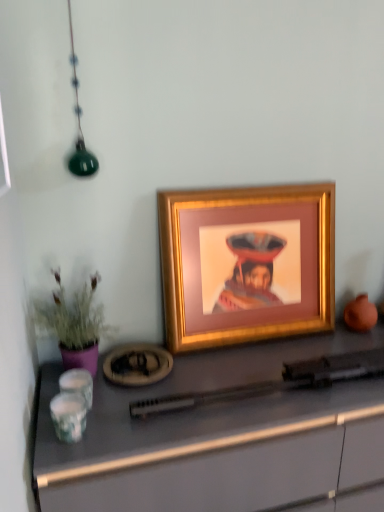
Question: In terms of height, does gold metallic picture frame at center look taller or shorter compared to purple matte plant at left?

Choices:
 (A) short
 (B) tall

Answer: (B)

Question: Considering the relative positions of gold metallic picture frame at center and purple matte plant at left in the image provided, is gold metallic picture frame at center to the left or to the right of purple matte plant at left?

Choices:
 (A) right
 (B) left

Answer: (A)

Question: Considering the real-world distances, which object is farthest from the purple matte plant at left?

Choices:
 (A) matte gray desk at center
 (B) gold metallic picture frame at center

Answer: (B)

Question: Considering the real-world distances, which object is closest to the purple matte plant at left?

Choices:
 (A) gold metallic picture frame at center
 (B) matte gray desk at center

Answer: (B)